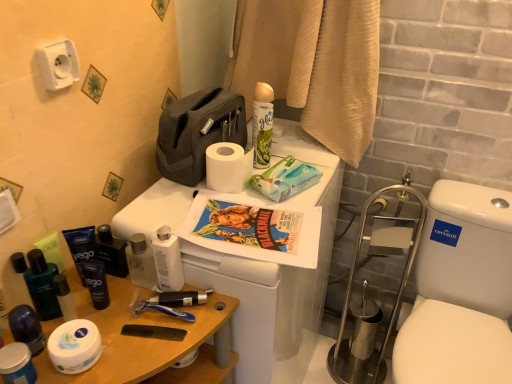
Where is `free point behind white matte toilet paper at lower left, which ranks as the 2th toilet paper in right-to-left order`? free point behind white matte toilet paper at lower left, which ranks as the 2th toilet paper in right-to-left order is located at coordinates (106, 308).